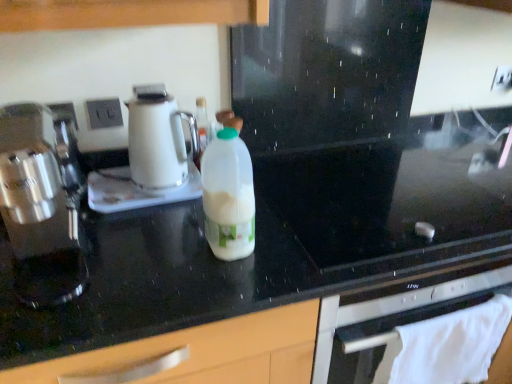
Find the location of a particular element. The image size is (512, 384). free spot above black glossy countertop at center (from a real-world perspective) is located at coordinates (328, 197).